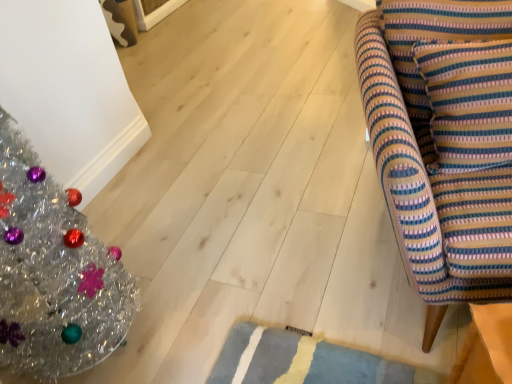
This screenshot has height=384, width=512. What are the coordinates of `shiny silver christmas tree at left` in the screenshot? It's located at (53, 273).

I want to click on striped fabric armchair at right, so click(443, 142).

The image size is (512, 384). Describe the element at coordinates (436, 36) in the screenshot. I see `striped fabric cushion at right` at that location.

At what (x,y) coordinates should I click in order to perform the action: click on shiny silver christmas tree at left. Please return your answer as a coordinate pair (x, y). Looking at the image, I should click on (53, 273).

Between striped fabric cushion at right and shiny silver christmas tree at left, which one is positioned in front?

shiny silver christmas tree at left.

Is striped fabric cushion at right outside of shiny silver christmas tree at left?

striped fabric cushion at right lies outside shiny silver christmas tree at left's area.

Considering the relative sizes of striped fabric cushion at right and shiny silver christmas tree at left in the image provided, is striped fabric cushion at right taller than shiny silver christmas tree at left?

In fact, striped fabric cushion at right may be shorter than shiny silver christmas tree at left.

From the image's perspective, is striped fabric cushion at right on shiny silver christmas tree at left?

Yes, from the image's perspective, striped fabric cushion at right is over shiny silver christmas tree at left.

From the image's perspective, would you say striped fabric armchair at right is positioned over shiny silver christmas tree at left?

Yes.

What are the coordinates of `furniture on the right of shiny silver christmas tree at left` in the screenshot? It's located at (443, 142).

Which is less distant, (x=396, y=207) or (x=73, y=201)?

Point (x=396, y=207)

Considering the sizes of objects striped fabric armchair at right and shiny silver christmas tree at left in the image provided, who is bigger, striped fabric armchair at right or shiny silver christmas tree at left?

striped fabric armchair at right.

Is striped fabric cushion at right shorter than striped fabric armchair at right?

Indeed, striped fabric cushion at right has a lesser height compared to striped fabric armchair at right.

From a real-world perspective, who is located higher, striped fabric cushion at right or striped fabric armchair at right?

striped fabric cushion at right.

Find the location of a particular element. The width and height of the screenshot is (512, 384). furniture in front of the striped fabric cushion at right is located at coordinates (443, 142).

Could striped fabric armchair at right be considered to be inside striped fabric cushion at right?

No.

Could you tell me if striped fabric armchair at right is turned towards striped fabric cushion at right?

Yes, striped fabric armchair at right is facing striped fabric cushion at right.

Locate an element on the screen. This screenshot has height=384, width=512. furniture on the right of striped fabric cushion at right is located at coordinates (443, 142).

From the picture: Can you confirm if striped fabric armchair at right is positioned to the left of striped fabric cushion at right?

No.

Which object is further away from the camera taking this photo, shiny silver christmas tree at left or striped fabric armchair at right?

striped fabric armchair at right is further from the camera.

Consider the image. Is shiny silver christmas tree at left facing towards striped fabric armchair at right?

No, shiny silver christmas tree at left is not turned towards striped fabric armchair at right.

Based on the photo, is shiny silver christmas tree at left positioned beyond the bounds of striped fabric armchair at right?

Yes, shiny silver christmas tree at left is located beyond the bounds of striped fabric armchair at right.

Is shiny silver christmas tree at left wider or thinner than striped fabric armchair at right?

Considering their sizes, shiny silver christmas tree at left looks slimmer than striped fabric armchair at right.

Would you say shiny silver christmas tree at left is a long distance from striped fabric cushion at right?

Yes, shiny silver christmas tree at left is far from striped fabric cushion at right.

Between shiny silver christmas tree at left and striped fabric cushion at right, which one has less height?

Standing shorter between the two is striped fabric cushion at right.

From the image's perspective, relative to striped fabric cushion at right, is shiny silver christmas tree at left above or below?

From the image's perspective, shiny silver christmas tree at left appears below striped fabric cushion at right.

Is shiny silver christmas tree at left oriented towards striped fabric cushion at right?

No, shiny silver christmas tree at left is not facing towards striped fabric cushion at right.

Identify the location of christmas tree that appears on the left of striped fabric cushion at right. The image size is (512, 384). (53, 273).

Locate an element on the screen. The height and width of the screenshot is (384, 512). furniture below the shiny silver christmas tree at left (from a real-world perspective) is located at coordinates (443, 142).

Based on their spatial positions, is striped fabric cushion at right or striped fabric armchair at right further from shiny silver christmas tree at left?

striped fabric cushion at right is positioned further to the anchor shiny silver christmas tree at left.

Estimate the real-world distances between objects in this image. Which object is closer to shiny silver christmas tree at left, striped fabric armchair at right or striped fabric cushion at right?

Among the two, striped fabric armchair at right is located nearer to shiny silver christmas tree at left.

Looking at this image, estimate the real-world distances between objects in this image. Which object is further from striped fabric cushion at right, striped fabric armchair at right or shiny silver christmas tree at left?

shiny silver christmas tree at left lies further to striped fabric cushion at right than the other object.

Which object lies nearer to the anchor point striped fabric armchair at right, striped fabric cushion at right or shiny silver christmas tree at left?

The object closer to striped fabric armchair at right is striped fabric cushion at right.

Based on their spatial positions, is shiny silver christmas tree at left or striped fabric cushion at right further from striped fabric armchair at right?

Based on the image, shiny silver christmas tree at left appears to be further to striped fabric armchair at right.

Considering their positions, is shiny silver christmas tree at left positioned closer to striped fabric cushion at right than striped fabric armchair at right?

Based on the image, striped fabric armchair at right appears to be nearer to striped fabric cushion at right.

Find the location of a particular element. pillow located between shiny silver christmas tree at left and striped fabric armchair at right in the left-right direction is located at coordinates (436, 36).